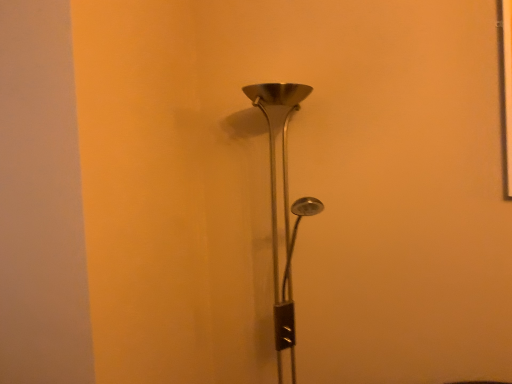
Question: Should I look upward or downward to see metallic silver lamp at center?

Choices:
 (A) up
 (B) down

Answer: (B)